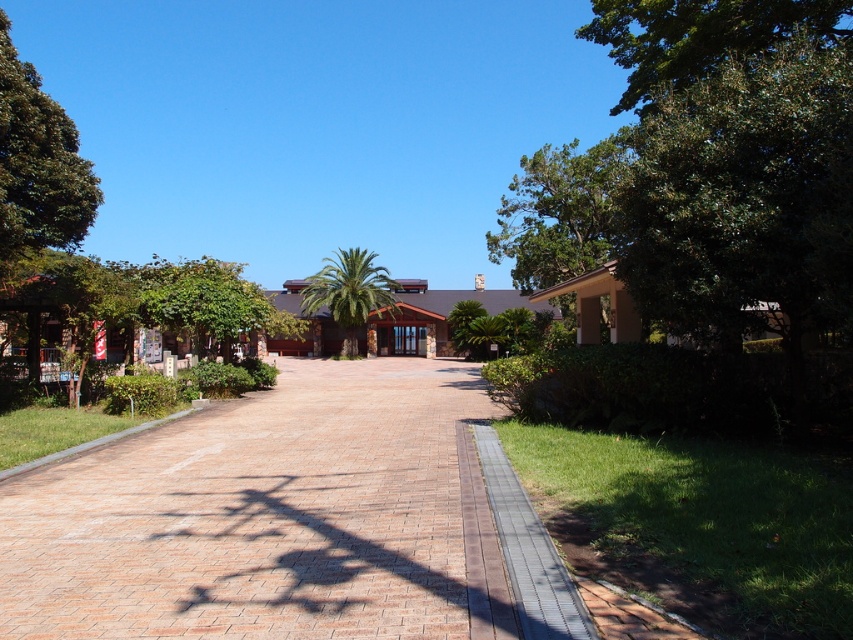
You are standing at the start of the paved pathway and want to reach the green leafy tree at right. Which direction should you walk to get there?

The green leafy tree at right is located at point (709, 172), so you should walk towards the right side of the image to reach it.

You are standing at the entrance of the pathway and want to reach the green leafy palm at center. Which direction should you walk to get there?

The green leafy palm at center is located at point (349,292), so you should walk towards the center of the image to reach it.

You are standing at the entrance of the garden and see both the green leafy palm at center and the green leafy tree at center. Which one is closer to you?

The green leafy palm at center is closer to you because the green leafy tree at center is behind it.